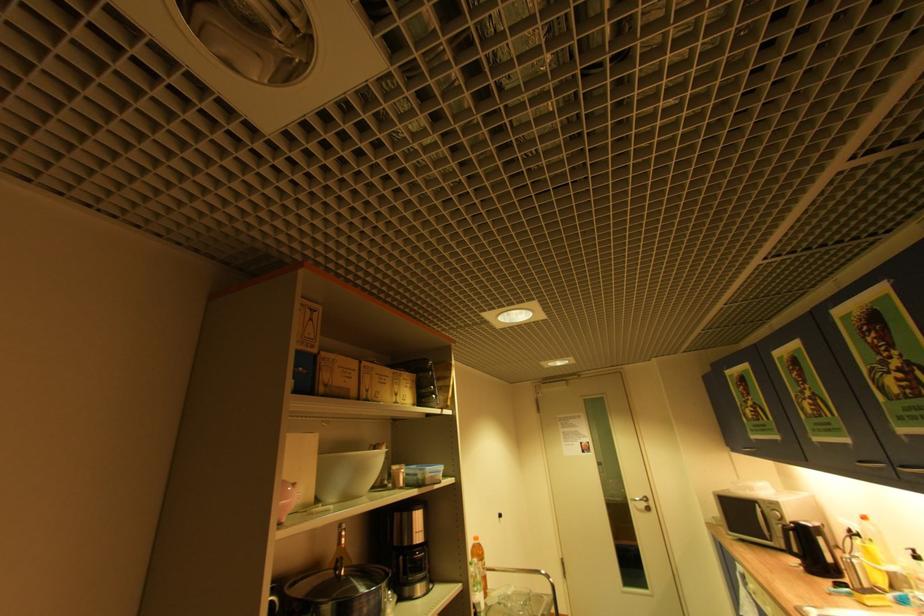
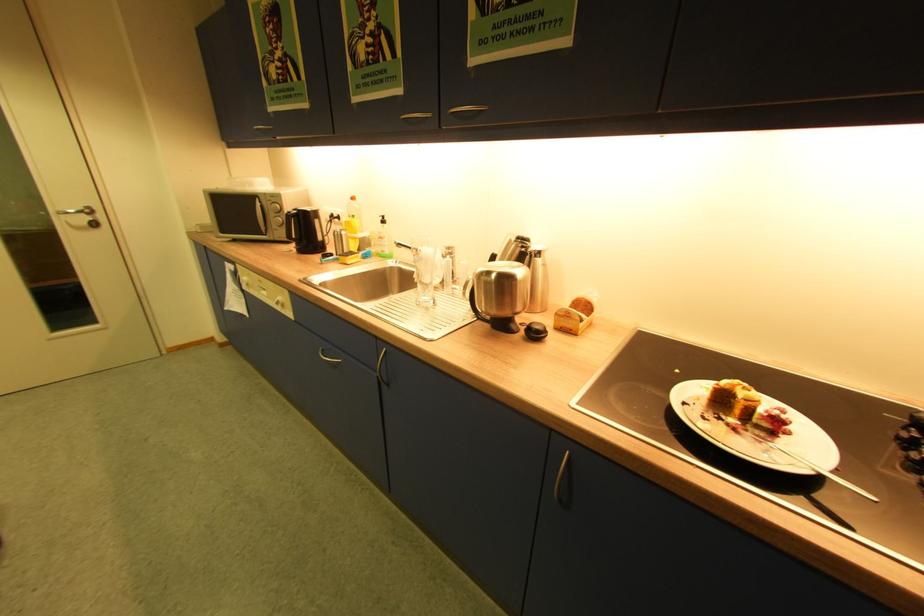
Locate, in the second image, the point that corresponds to point (859, 562) in the first image.

(348, 233)